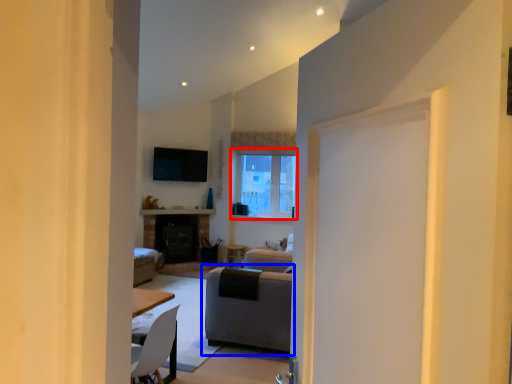
Question: Which object appears farthest to the camera in this image, window (highlighted by a red box) or studio couch (highlighted by a blue box)?

Choices:
 (A) window
 (B) studio couch

Answer: (A)